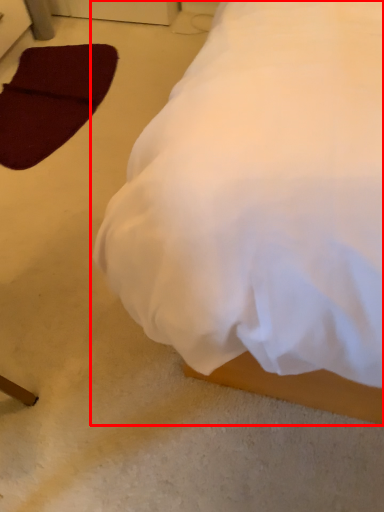
Question: From the image, what is the correct spatial relationship of bed (annotated by the red box) in relation to pad?

Choices:
 (A) right
 (B) left

Answer: (A)